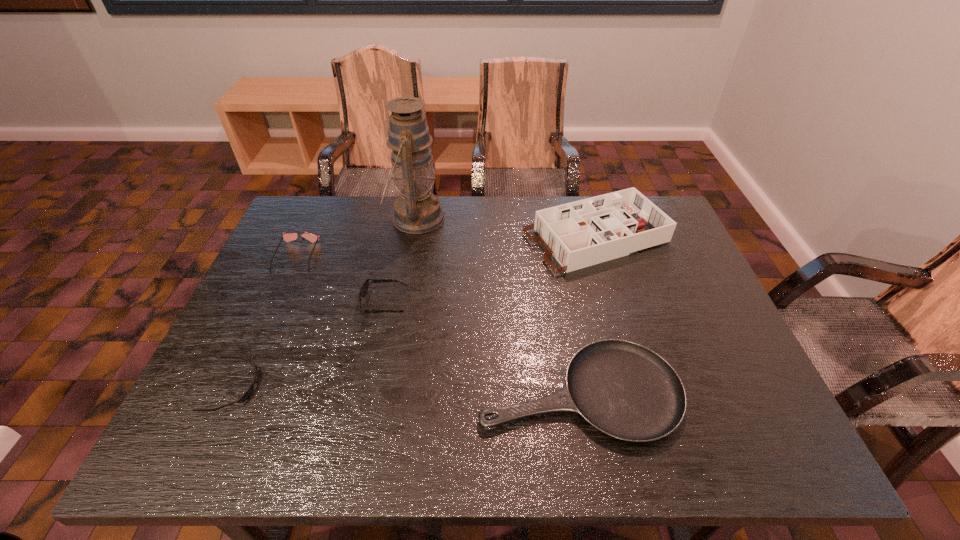
Identify the location of the tallest object. The width and height of the screenshot is (960, 540). (417, 211).

This screenshot has height=540, width=960. Find the location of `the second tallest object`. the second tallest object is located at coordinates (583, 233).

This screenshot has height=540, width=960. Find the location of `the farthest sunglasses`. the farthest sunglasses is located at coordinates (287, 237).

I want to click on the second farthest sunglasses, so click(x=364, y=288).

Identify the location of the rightmost sunglasses. (364, 288).

Locate an element on the screen. This screenshot has width=960, height=540. frying pan is located at coordinates (625, 390).

Image resolution: width=960 pixels, height=540 pixels. I want to click on the shortest sunglasses, so click(x=248, y=393).

Find the location of `vacant space located 0.280m on the left of the oil lamp`. vacant space located 0.280m on the left of the oil lamp is located at coordinates (299, 218).

This screenshot has height=540, width=960. Find the location of `vacant space located on the left of the dollhouse`. vacant space located on the left of the dollhouse is located at coordinates (450, 238).

Image resolution: width=960 pixels, height=540 pixels. What are the coordinates of `vacant space situated on the bridge of the farthest sunglasses` in the screenshot? It's located at (237, 388).